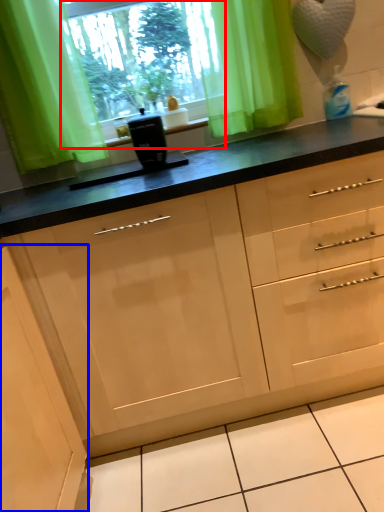
Question: Which object is closer to the camera taking this photo, window screen (highlighted by a red box) or cabinetry (highlighted by a blue box)?

Choices:
 (A) window screen
 (B) cabinetry

Answer: (B)